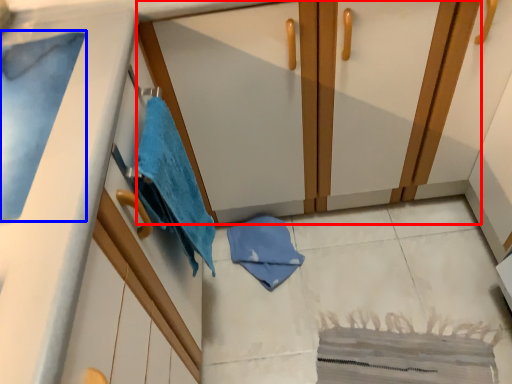
Question: Which object appears closest to the camera in this image, dresser (highlighted by a red box) or bath towel (highlighted by a blue box)?

Choices:
 (A) dresser
 (B) bath towel

Answer: (B)